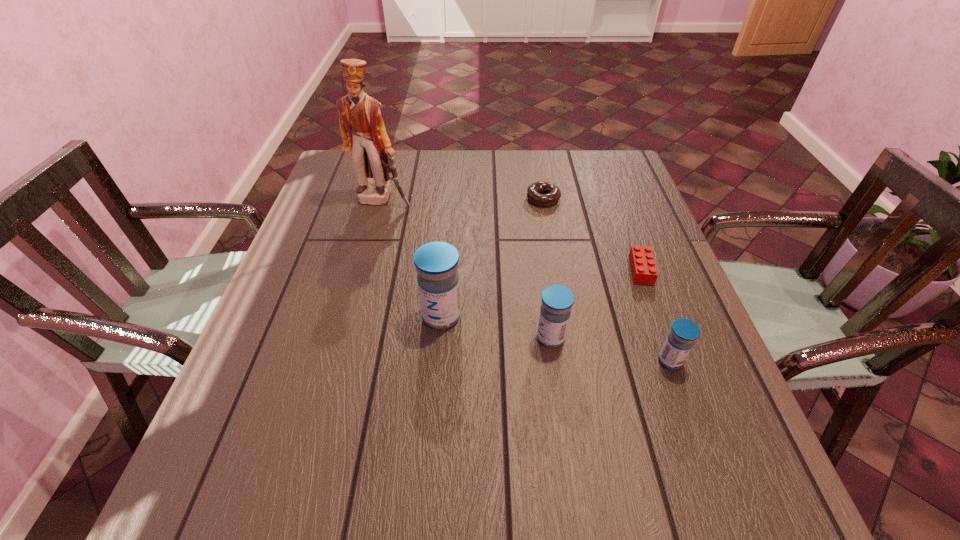
Identify which medicine is located as the second nearest to the third farthest object. Please provide its 2D coordinates. Your answer should be formatted as a tuple, i.e. [(x, y)], where the tuple contains the x and y coordinates of a point satisfying the conditions above.

[(557, 300)]

Identify the location of free point that satisfies the following two spatial constraints: 1. on the front side of the nearest object; 2. on the left side of the doughnut. The image size is (960, 540). (571, 361).

Where is `vacant position in the image that satisfies the following two spatial constraints: 1. on the front-facing side of the tallest object; 2. on the right side of the tallest medicine`? vacant position in the image that satisfies the following two spatial constraints: 1. on the front-facing side of the tallest object; 2. on the right side of the tallest medicine is located at coordinates (351, 316).